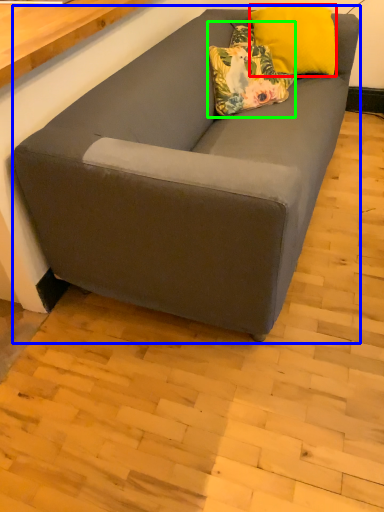
Question: Which object is the farthest from pillow (highlighted by a red box)? Choose among these: studio couch (highlighted by a blue box) or pillow (highlighted by a green box).

Choices:
 (A) studio couch
 (B) pillow

Answer: (A)